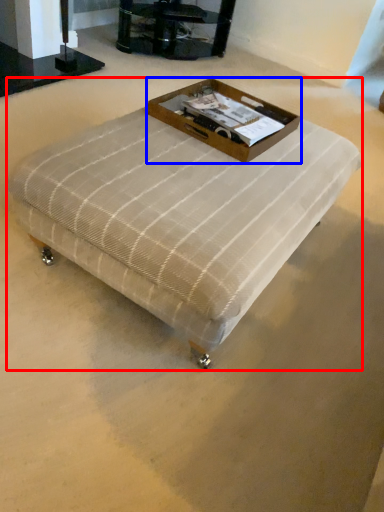
Question: Which object appears closest to the camera in this image, table (highlighted by a red box) or box (highlighted by a blue box)?

Choices:
 (A) table
 (B) box

Answer: (A)